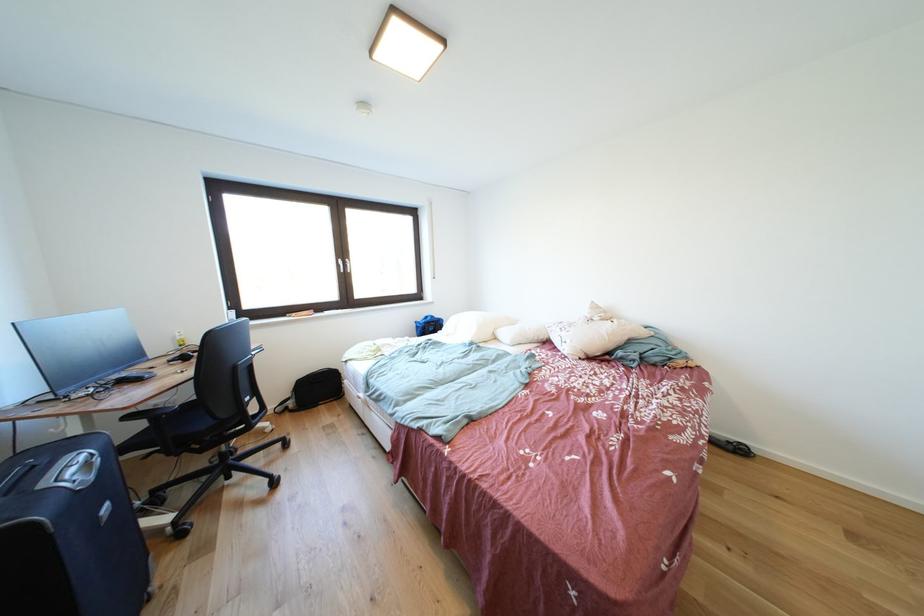
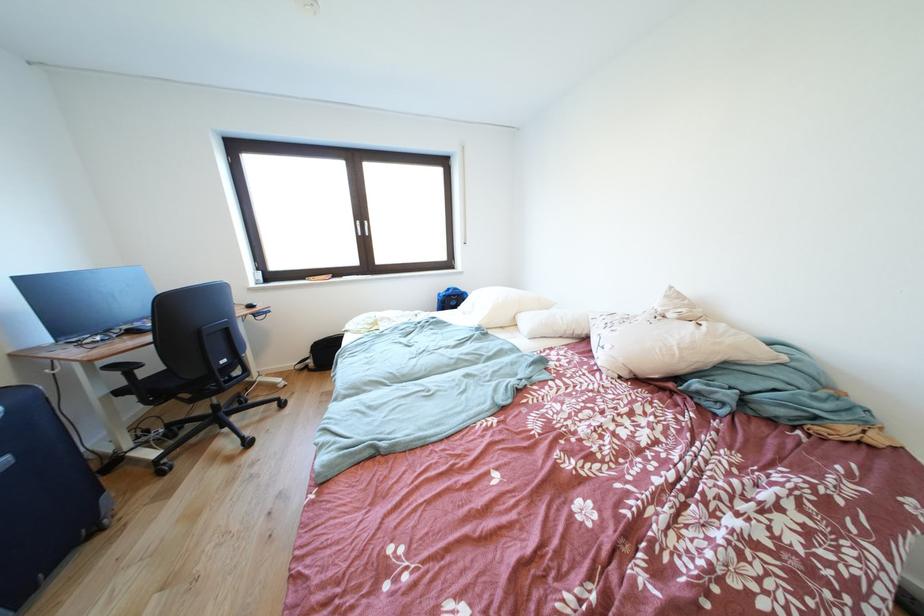
Locate, in the second image, the point that corresponds to the point at 295,411 in the first image.

(315, 371)